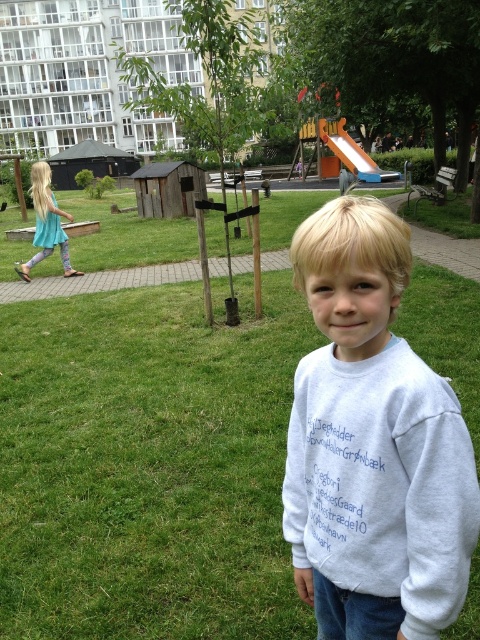
Is point (332, 209) positioned after point (47, 196)?

No, (332, 209) is closer to viewer.

The width and height of the screenshot is (480, 640). Find the location of `white cotton sweatshirt at center`. white cotton sweatshirt at center is located at coordinates (372, 442).

Where is `white cotton sweatshirt at center`? white cotton sweatshirt at center is located at coordinates (372, 442).

Is green grass at center further to camera compared to turquoise fabric dress at left?

That is False.

Does green grass at center appear over turquoise fabric dress at left?

Actually, green grass at center is below turquoise fabric dress at left.

Who is more distant from viewer, (108,321) or (20,264)?

Positioned behind is point (20,264).

Locate an element on the screen. The height and width of the screenshot is (640, 480). green grass at center is located at coordinates (147, 465).

Can you confirm if green grass at center is positioned to the right of white cotton sweatshirt at center?

In fact, green grass at center is to the left of white cotton sweatshirt at center.

Between green grass at center and white cotton sweatshirt at center, which one has less height?

With less height is white cotton sweatshirt at center.

Between point (146, 308) and point (348, 529), which one is positioned behind?

The point (146, 308) is behind.

This screenshot has width=480, height=640. Identify the location of green grass at center. (147, 465).